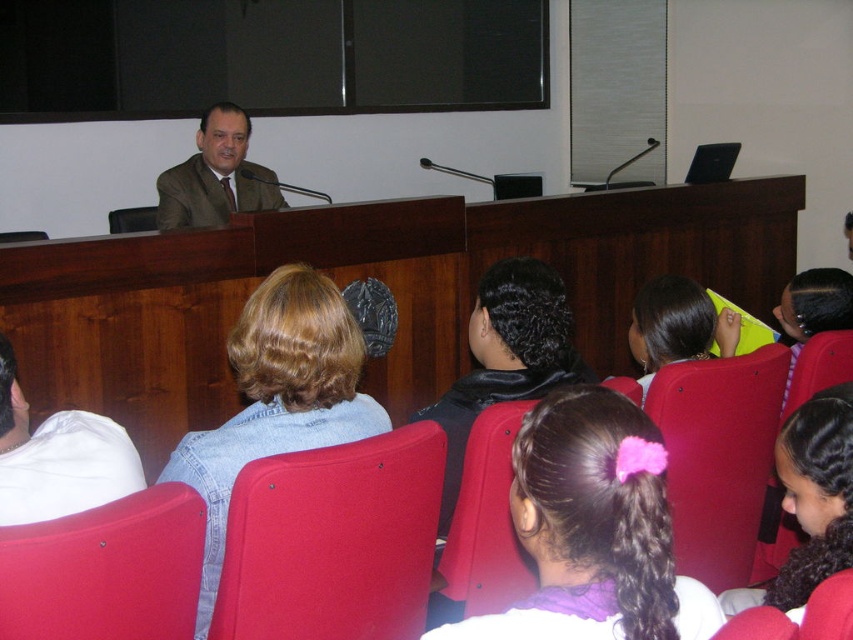
You are standing at the origin point of the coordinate system in the image. You need to walk towards the red plastic chair at lower center. In which direction should you move first?

The red plastic chair at lower center is located at coordinates point (483,525). Since you are at the origin, you should move in the positive x and positive y direction to reach it.

You are sitting in the front row of the lecture hall and want to hand the speaker a note. You have a matte red chair at lower center in front of you and a brown textured suit at upper center. Which object is closer to you so you can reach it easily?

The matte red chair at lower center is closer to the viewer than the brown textured suit at upper center, so you can reach it easily.